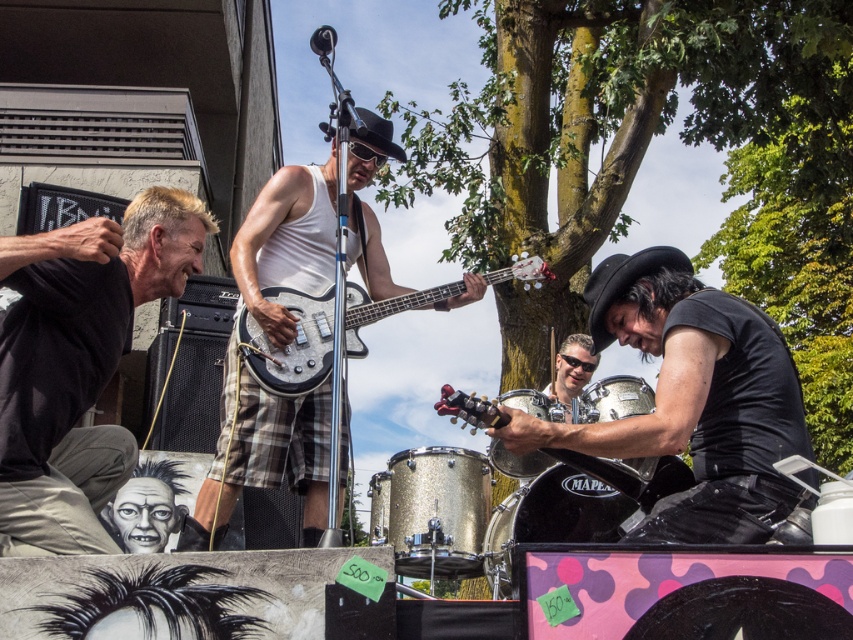
At what (x,y) coordinates should I click in order to perform the action: click on white matte tank top at center. Please return your answer as a coordinate pair (x, y). Looking at the image, I should click on (265, 449).

In the scene shown: Is white matte tank top at center further to the viewer compared to sunglassesmaterial at center?

That is False.

Describe the element at coordinates (265, 449) in the screenshot. I see `white matte tank top at center` at that location.

Identify the location of white matte tank top at center. (265, 449).

Can you confirm if black matte shirt at lower left is taller than black matte guitar at center?

Yes.

Looking at this image, who is more forward, (62,481) or (776,372)?

Point (62,481)

This screenshot has width=853, height=640. What are the coordinates of `black matte shirt at lower left` in the screenshot? It's located at (78, 360).

Does black matte shirt at lower left have a lesser height compared to sunglassesmaterial at center?

In fact, black matte shirt at lower left may be taller than sunglassesmaterial at center.

Which is behind, point (97, 236) or point (573, 362)?

The point (573, 362) is behind.

Who is more distant from viewer, (142, 208) or (579, 362)?

Point (579, 362)

Where is `black matte shirt at lower left`? black matte shirt at lower left is located at coordinates (78, 360).